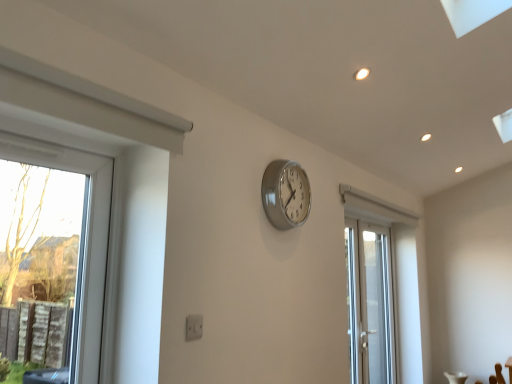
Measure the distance between silver metallic clock at center and camera.

silver metallic clock at center is 2.07 meters away from camera.

This screenshot has height=384, width=512. What are the coordinates of `silver metallic clock at center` in the screenshot? It's located at (285, 194).

Describe the element at coordinates (285, 194) in the screenshot. I see `silver metallic clock at center` at that location.

What is the approximate width of silver metallic clock at center?

3.73 inches.

In order to face white glossy door at center-right, should I rotate leftwards or rightwards?

Rotate your view right by about 15.672°.

The image size is (512, 384). Describe the element at coordinates (369, 304) in the screenshot. I see `white glossy door at center-right` at that location.

This screenshot has width=512, height=384. What are the coordinates of `white glossy door at center-right` in the screenshot? It's located at (369, 304).

Measure the distance between white glossy door at center-right and camera.

white glossy door at center-right and camera are 10.36 feet apart from each other.

Identify the location of silver metallic clock at center. This screenshot has height=384, width=512. (285, 194).

Is white glossy door at center-right at the right side of silver metallic clock at center?

Yes, white glossy door at center-right is to the right of silver metallic clock at center.

Which is behind, white glossy door at center-right or silver metallic clock at center?

white glossy door at center-right is further from the camera.

Is point (359, 263) closer or farther from the camera than point (296, 221)?

Point (359, 263).

Based on the photo, from the image's perspective, is white glossy door at center-right beneath silver metallic clock at center?

Yes, from the image's perspective, white glossy door at center-right is beneath silver metallic clock at center.

From a real-world perspective, is white glossy door at center-right physically above silver metallic clock at center?

No, from a real-world perspective, white glossy door at center-right is not over silver metallic clock at center

Which object is wider, white glossy door at center-right or silver metallic clock at center?

white glossy door at center-right is wider.

Is white glossy door at center-right taller or shorter than silver metallic clock at center?

Clearly, white glossy door at center-right is taller compared to silver metallic clock at center.

Considering the sizes of objects white glossy door at center-right and silver metallic clock at center in the image provided, who is bigger, white glossy door at center-right or silver metallic clock at center?

white glossy door at center-right.

Is white glossy door at center-right situated inside silver metallic clock at center or outside?

white glossy door at center-right is spatially situated outside silver metallic clock at center.

Is white glossy door at center-right not near silver metallic clock at center?

That's right, there is a large distance between white glossy door at center-right and silver metallic clock at center.

Is white glossy door at center-right aimed at silver metallic clock at center?

No, white glossy door at center-right is not oriented towards silver metallic clock at center.

Image resolution: width=512 pixels, height=384 pixels. I want to click on door that is on the right side of silver metallic clock at center, so click(x=369, y=304).

Which object is positioned more to the left, silver metallic clock at center or white glossy door at center-right?

silver metallic clock at center.

Relative to white glossy door at center-right, is silver metallic clock at center in front or behind?

In the image, silver metallic clock at center appears in front of white glossy door at center-right.

Between point (292, 223) and point (349, 251), which one is positioned behind?

The point (349, 251) is behind.

From the image's perspective, is silver metallic clock at center above or below white glossy door at center-right?

silver metallic clock at center is situated higher than white glossy door at center-right in the image.

Looking at this image, from a real-world perspective, which object rests below the other?

white glossy door at center-right.

Considering the sizes of objects silver metallic clock at center and white glossy door at center-right in the image provided, who is wider, silver metallic clock at center or white glossy door at center-right?

Wider between the two is white glossy door at center-right.

Who is shorter, silver metallic clock at center or white glossy door at center-right?

Standing shorter between the two is silver metallic clock at center.

Can you confirm if silver metallic clock at center is bigger than white glossy door at center-right?

Actually, silver metallic clock at center might be smaller than white glossy door at center-right.

Is silver metallic clock at center situated inside white glossy door at center-right or outside?

silver metallic clock at center is located beyond the bounds of white glossy door at center-right.

Would you say silver metallic clock at center is a long distance from white glossy door at center-right?

Yes, silver metallic clock at center and white glossy door at center-right are quite far apart.

Is silver metallic clock at center positioned with its back to white glossy door at center-right?

No, silver metallic clock at center's orientation is not away from white glossy door at center-right.

Where is `wall clock located on the left of white glossy door at center-right`? Image resolution: width=512 pixels, height=384 pixels. wall clock located on the left of white glossy door at center-right is located at coordinates (285, 194).

Identify the location of wall clock positioned vertically above the white glossy door at center-right (from a real-world perspective). This screenshot has height=384, width=512. (285, 194).

The image size is (512, 384). In the image, there is a silver metallic clock at center. Find the location of `door below it (from a real-world perspective)`. door below it (from a real-world perspective) is located at coordinates (369, 304).